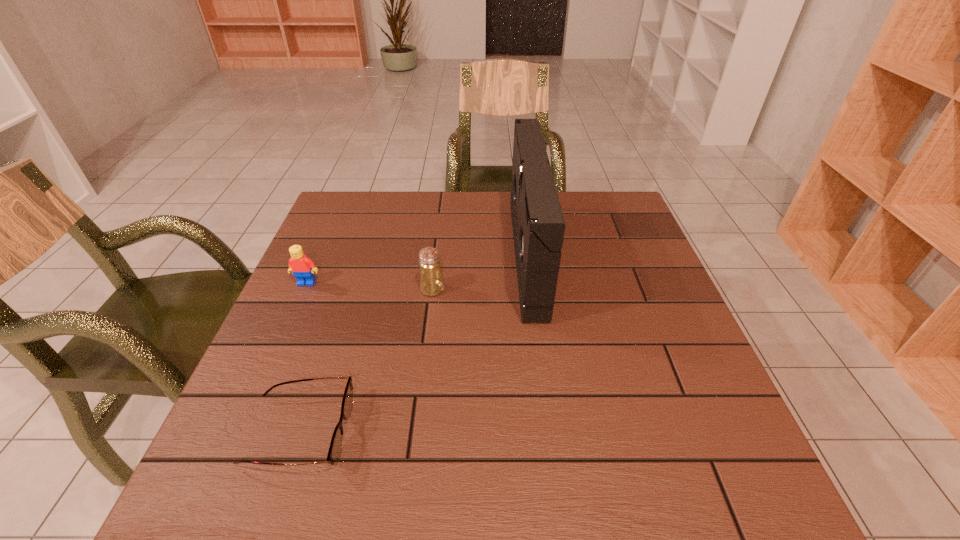
The height and width of the screenshot is (540, 960). In the image, there is a desktop. In order to click on vacant space at the far left corner in this screenshot , I will do click(336, 205).

Image resolution: width=960 pixels, height=540 pixels. Identify the location of vacant area at the near left corner of the desktop. (228, 510).

Locate an element on the screen. The height and width of the screenshot is (540, 960). free spot at the far right corner of the desktop is located at coordinates (622, 235).

Where is `vacant space at the near right corner of the desktop`? This screenshot has width=960, height=540. vacant space at the near right corner of the desktop is located at coordinates (708, 495).

Locate an element on the screen. This screenshot has height=540, width=960. vacant point located between the shortest object and the rightmost object is located at coordinates (414, 344).

Identify the location of empty space between the spectacles and the Lego. This screenshot has height=540, width=960. (303, 357).

Locate an element on the screen. This screenshot has width=960, height=540. free space between the nearest object and the videotape is located at coordinates (414, 344).

Where is `empty space that is in between the saltshaker and the Lego`? Image resolution: width=960 pixels, height=540 pixels. empty space that is in between the saltshaker and the Lego is located at coordinates (370, 286).

Locate an element on the screen. The image size is (960, 540). vacant area between the spectacles and the Lego is located at coordinates (303, 357).

Where is `free space between the Lego and the saltshaker`? The height and width of the screenshot is (540, 960). free space between the Lego and the saltshaker is located at coordinates (370, 286).